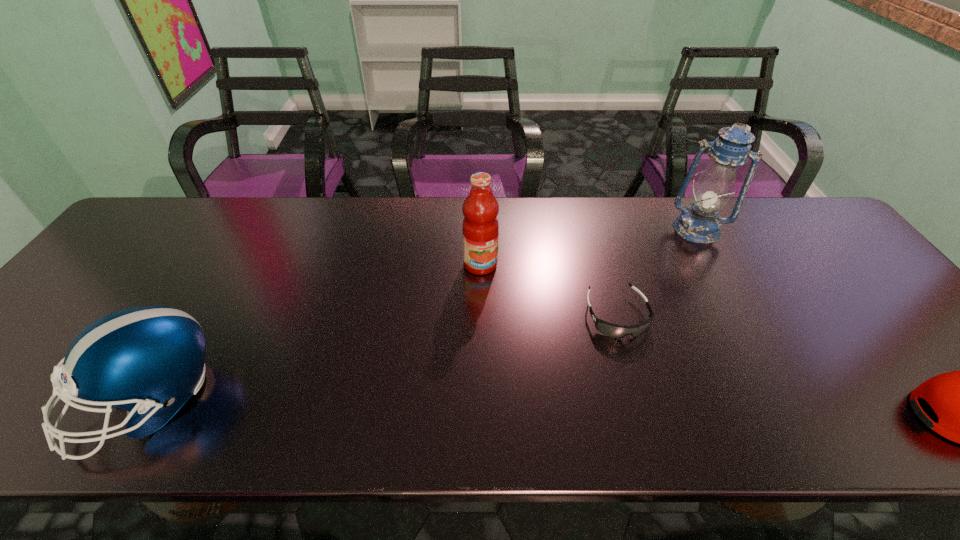
This screenshot has height=540, width=960. What are the coordinates of `vacant region that satisfies the following two spatial constraints: 1. on the back side of the lantern; 2. on the right side of the fourth nearest object` in the screenshot? It's located at (481, 229).